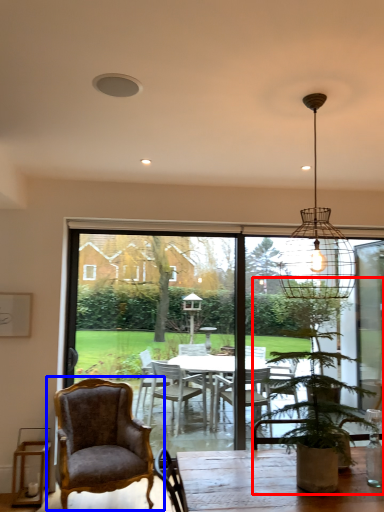
Question: Among these objects, which one is farthest to the camera, houseplant (highlighted by a red box) or chair (highlighted by a blue box)?

Choices:
 (A) houseplant
 (B) chair

Answer: (B)